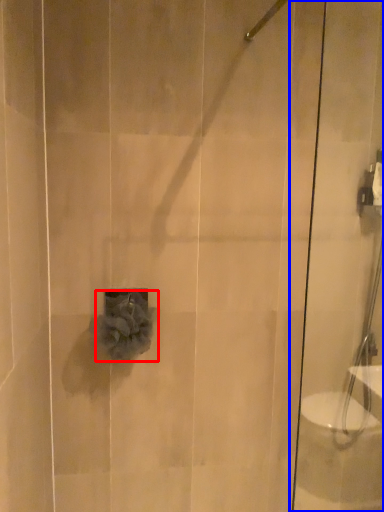
Question: Among these objects, which one is farthest to the camera, flower (highlighted by a red box) or shower door (highlighted by a blue box)?

Choices:
 (A) flower
 (B) shower door

Answer: (A)